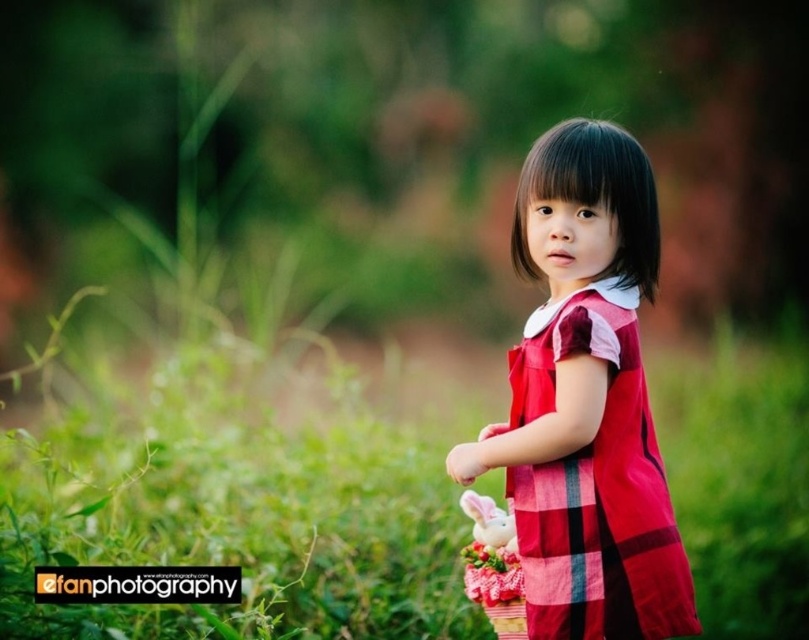
The child in the red dress with a plaid pattern and a white collar is standing in a natural setting. There is a point at coordinates [235,513]. Based on the scene description, what is the location of this point relative to the child?

The point at coordinates [235,513] is on the green grass at center, which is the area where the child is standing.

The child is holding a basket with a stuffed rabbit and flowers. The red plaid dress at center and the fluffy pink flower at center are both in the scene. Which object is taller?

The red plaid dress at center is much taller than the fluffy pink flower at center.

Looking at this image, you are taking a photo of the child in the garden. You want to focus on the point that is closer to the camera. Which point should you choose between point (714, 588) and point (649, 589)?

Point (649, 589) is closer to the camera than point (714, 588), so you should focus on point (649, 589).